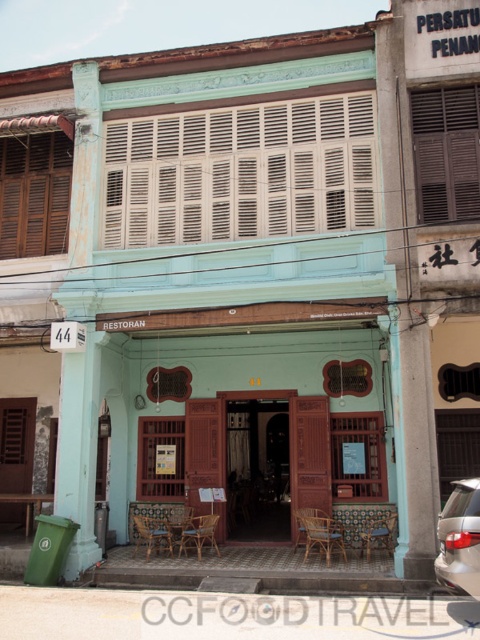
Can you confirm if satin silver car at lower right is shorter than brown woven chair at center?

In fact, satin silver car at lower right may be taller than brown woven chair at center.

Is satin silver car at lower right bigger than brown woven chair at center?

Yes.

Is point (478, 588) more distant than point (307, 515)?

No, (478, 588) is closer to viewer.

This screenshot has height=640, width=480. In order to click on satin silver car at lower right in this screenshot , I will do `click(459, 538)`.

Is point (467, 509) positioned after point (199, 536)?

No, it is in front of (199, 536).

Who is shorter, satin silver car at lower right or woven rattan chair at center?

With less height is woven rattan chair at center.

Find the location of a particular element. This screenshot has height=640, width=480. satin silver car at lower right is located at coordinates (459, 538).

This screenshot has width=480, height=640. Find the location of `satin silver car at lower right`. satin silver car at lower right is located at coordinates (459, 538).

Measure the distance from rattan chair at center to brown woven chair at center.

A distance of 12.57 inches exists between rattan chair at center and brown woven chair at center.

Does rattan chair at center have a smaller size compared to brown woven chair at center?

Incorrect, rattan chair at center is not smaller in size than brown woven chair at center.

Measure the distance between point (307, 515) and camera.

Point (307, 515) is 36.64 feet from camera.

The image size is (480, 640). Identify the location of rattan chair at center. (322, 534).